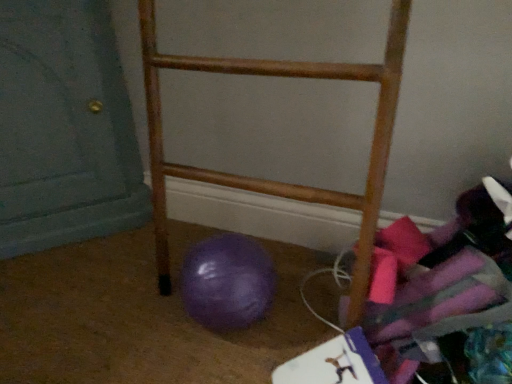
What are the coordinates of `vacant area situated to the left side of wooden rack at center` in the screenshot? It's located at (124, 303).